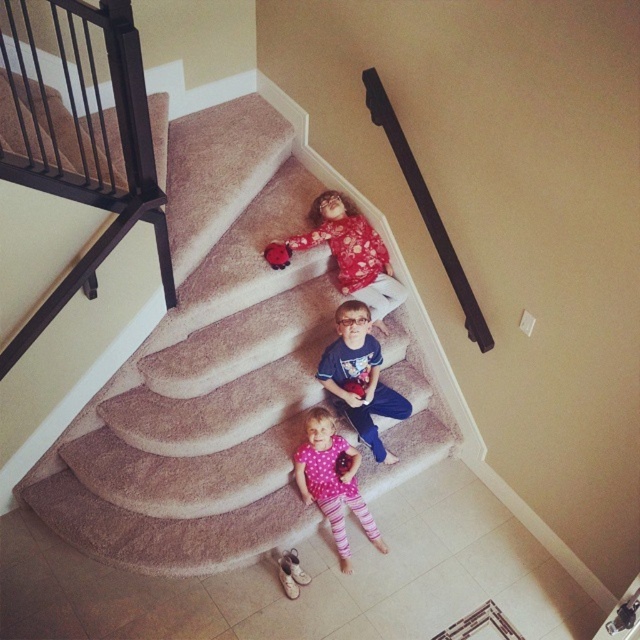
You are trying to determine if the matte floral dress at center can be placed on the carpeted stairs at center without covering the entire surface. Based on their sizes, is this possible?

The carpeted stairs at center is bigger than the matte floral dress at center, so yes, the dress can be placed on the stairs without covering the entire surface.

You are a photographer trying to capture a candid shot of the pink polka dot shirt at center without including the black metal balustrade at upper left in the frame. Based on their positions, is this possible?

The black metal balustrade at upper left is in front of the pink polka dot shirt at center, so it would block the view. To capture the pink polka dot shirt at center without the balustrade, the photographer would need to adjust their angle or position to go around the balustrade.

You are taking a photo of two points in the scene. The first point is at coordinate point (356, 291) and the second is at point (326, 364). Which point will appear closer to the camera in the photo?

Point (356, 291) is further to the camera than point (326, 364), so the first point will appear closer to the camera in the photo.